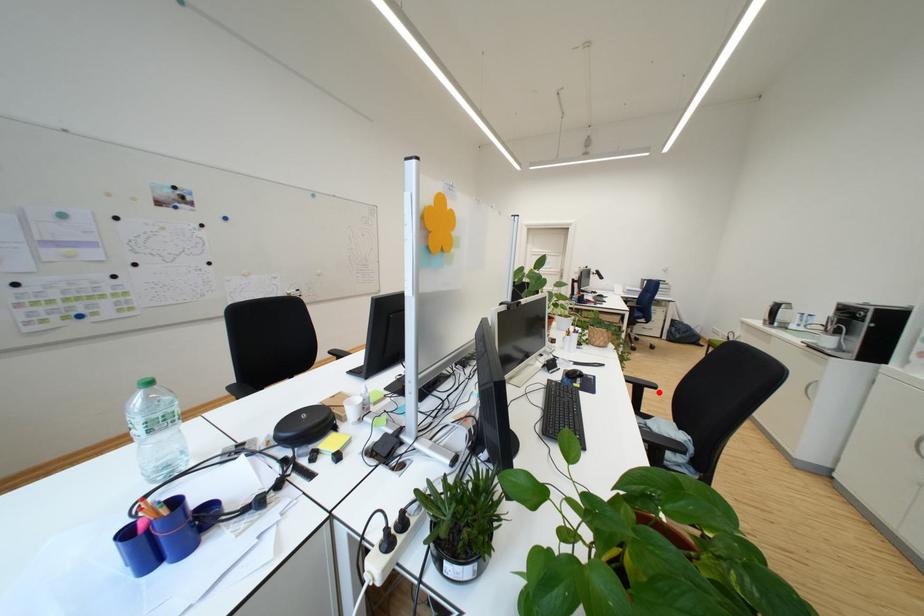
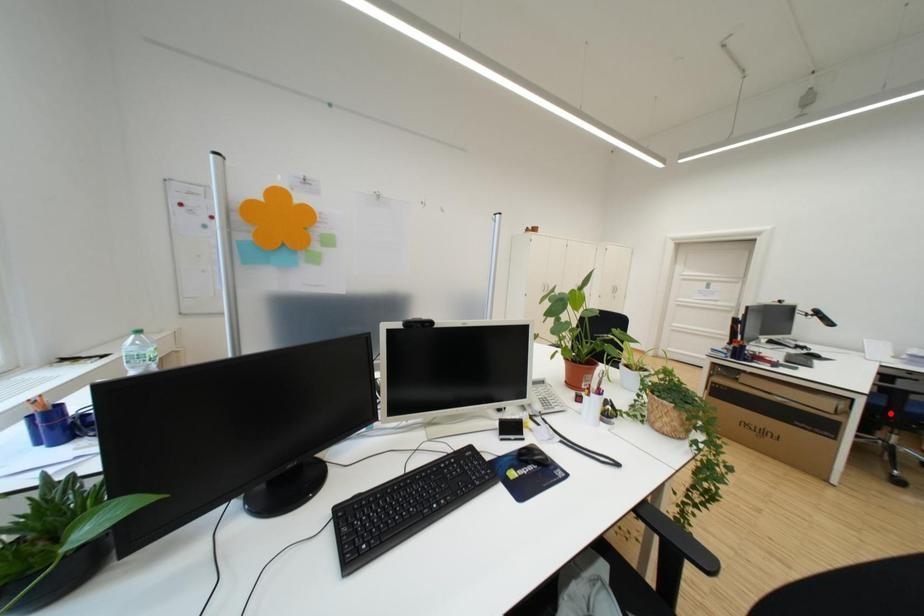
I am providing you with two images of the same scene from different viewpoints. A red point is marked on the first image and another point is marked on the second image. Is the red point in image1 aligned with the point shown in image2?

No